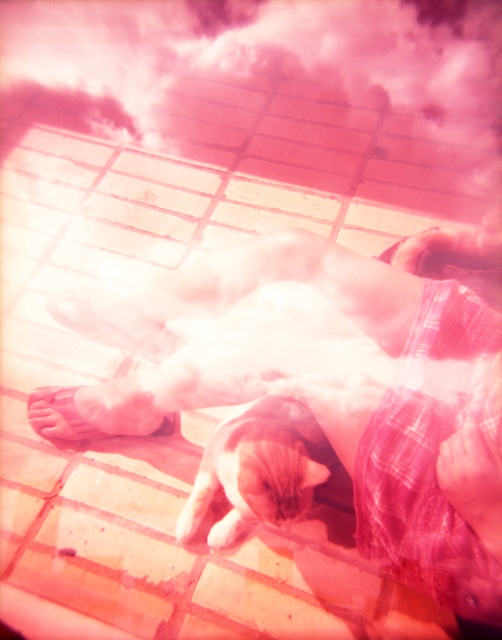
Between tabby fur cat at center and smooth pink foot at center, which one has more height?

tabby fur cat at center

Between point (368, 452) and point (120, 337), which one is positioned in front?

Point (368, 452) is more forward.

Who is more distant from viewer, (483, 596) or (132, 340)?

The point (132, 340) is behind.

Image resolution: width=502 pixels, height=640 pixels. I want to click on tabby fur cat at center, so click(x=328, y=392).

Does soft fur cat at center appear on the right side of smooth pink foot at center?

Indeed, soft fur cat at center is positioned on the right side of smooth pink foot at center.

Which is more to the right, soft fur cat at center or smooth pink foot at center?

soft fur cat at center

Between point (252, 403) and point (155, 307), which one is positioned in front?

Point (252, 403) is more forward.

Where is `soft fur cat at center`? The image size is (502, 640). soft fur cat at center is located at coordinates (257, 468).

The width and height of the screenshot is (502, 640). Identify the location of pink matte sandal at lower left. (94, 410).

Can you confirm if pink matte sandal at lower left is positioned below smooth pink foot at center?

Indeed, pink matte sandal at lower left is positioned under smooth pink foot at center.

Does point (122, 428) lie behind point (75, 300)?

No, it is in front of (75, 300).

Where is `pink matte sandal at lower left`? pink matte sandal at lower left is located at coordinates (94, 410).